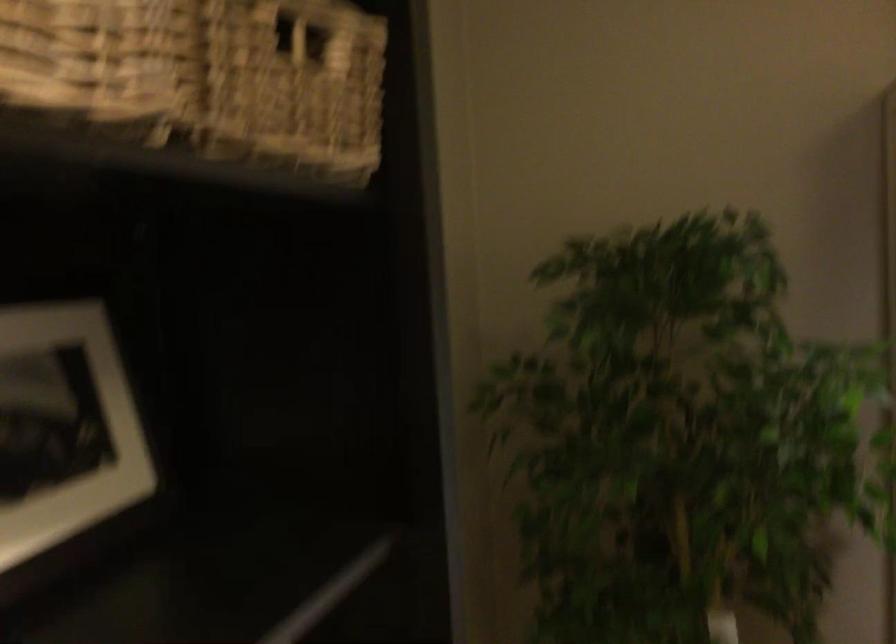
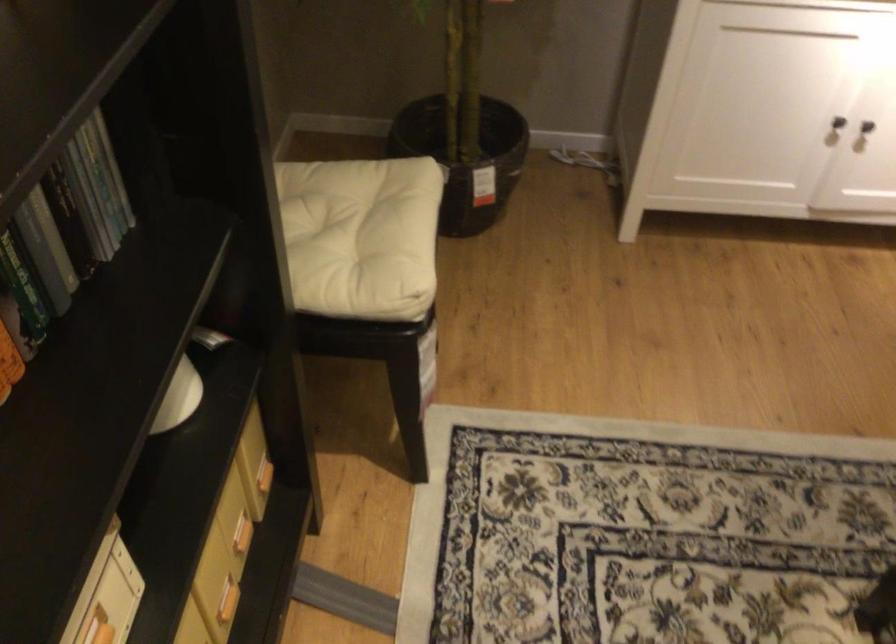
Based on the continuous images, in which direction is the camera rotating?

The rotation direction of the camera is right-down.